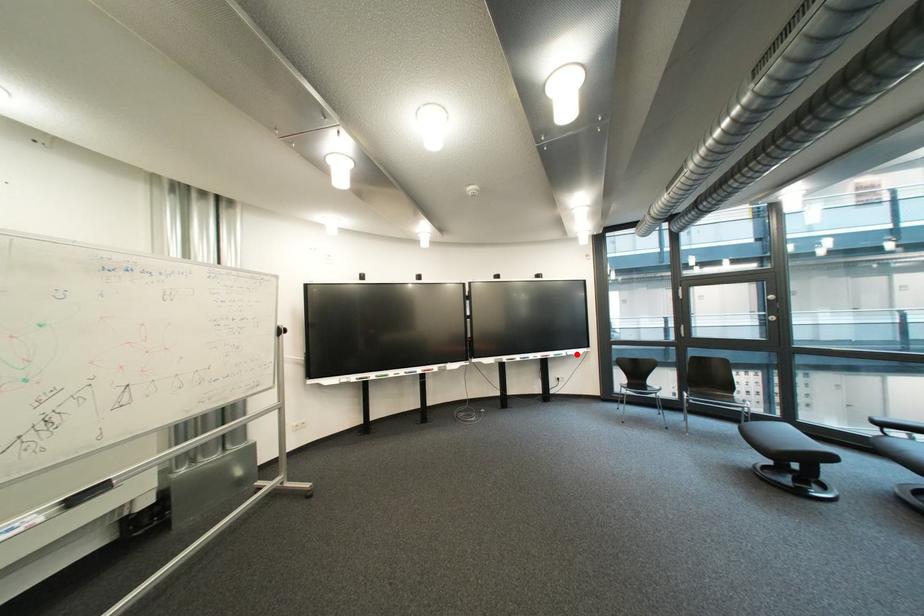
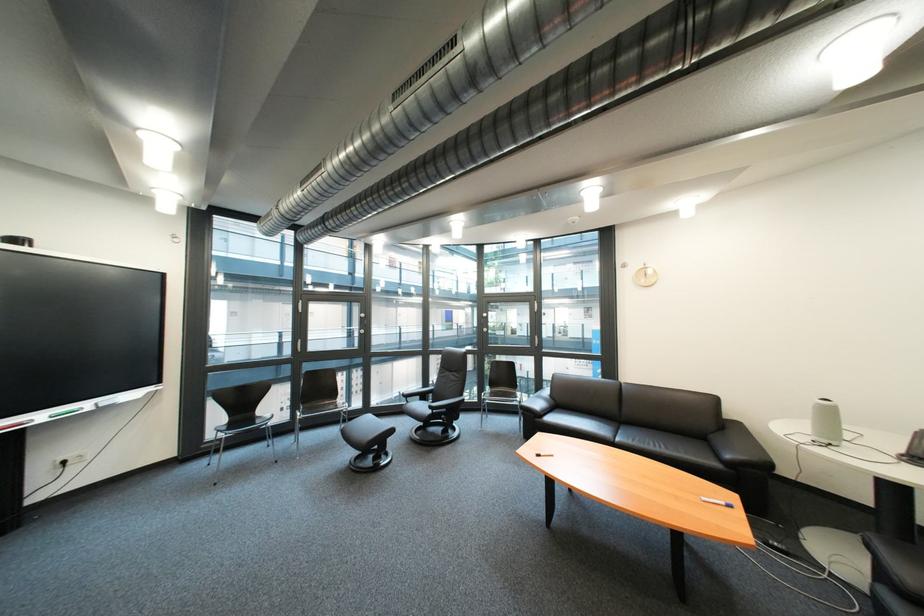
Question: I am providing you with two images of the same scene from different viewpoints. A red point is marked on the first image. Can you still see the location of the red point in image 2?

Choices:
 (A) Yes
 (B) No

Answer: (A)